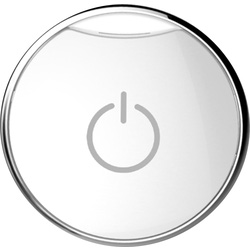
At what (x,y) coordinates should I click in order to perform the action: click on dark grey lighting. Please return your answer as a coordinate pair (x, y). The height and width of the screenshot is (250, 250). Looking at the image, I should click on (207, 84).